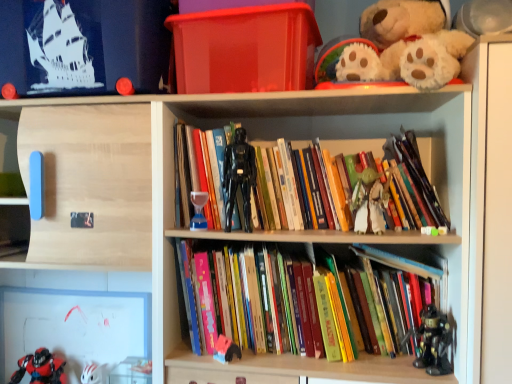
You are a GUI agent. You are given a task and a screenshot of the screen. Output one action in this format:
    pyautogui.click(x=<x>, y=<y>)
    Task: Click on the free region under white plush toy at upper right (from a real-world perspective)
    
    Given the screenshot: What is the action you would take?
    pyautogui.click(x=396, y=99)